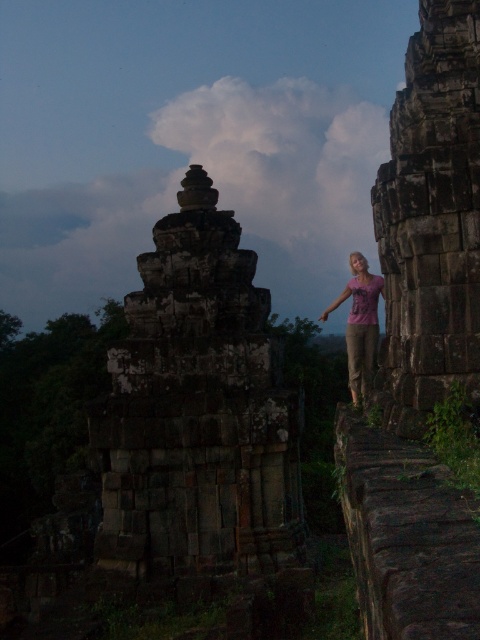
Question: Can you confirm if dark stone ruins at center is thinner than purple cotton shirt at center-right?

Choices:
 (A) yes
 (B) no

Answer: (A)

Question: Which point is farther to the camera?

Choices:
 (A) dark stone ruins at center
 (B) purple cotton shirt at center-right

Answer: (A)

Question: Which object is farther from the camera taking this photo?

Choices:
 (A) purple cotton shirt at center-right
 (B) dark stone ruins at center

Answer: (B)

Question: Does dark stone ruins at center have a lesser width compared to purple cotton shirt at center-right?

Choices:
 (A) yes
 (B) no

Answer: (A)

Question: Where is dark stone ruins at center located in relation to purple cotton shirt at center-right in the image?

Choices:
 (A) left
 (B) right

Answer: (A)